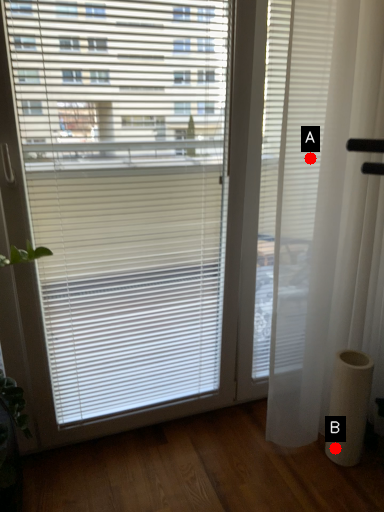
Question: Two points are circled on the image, labeled by A and B beside each circle. Which point is further to the camera?

Choices:
 (A) A is further
 (B) B is further

Answer: (B)